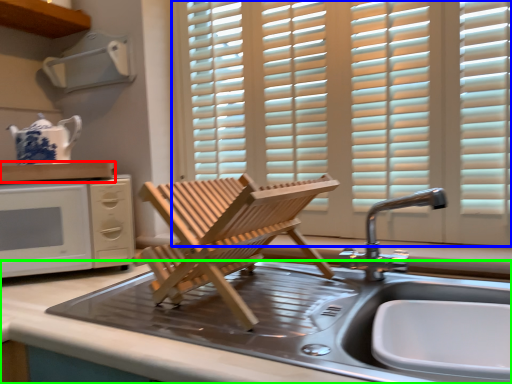
Question: Which object is positioned farthest from countertop (highlighted by a red box)? Select from window (highlighted by a blue box) and countertop (highlighted by a green box).

Choices:
 (A) window
 (B) countertop

Answer: (A)